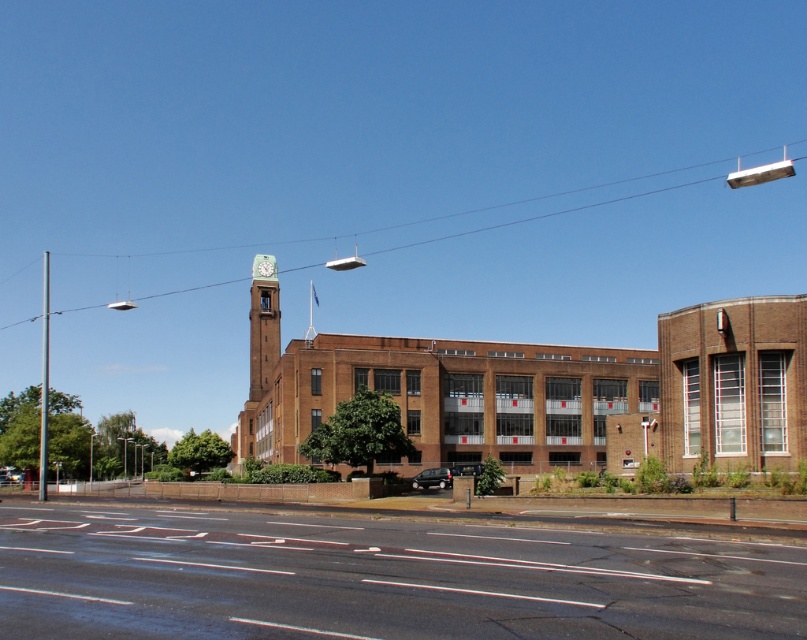
You are a delivery driver approaching the building and need to park your shiny black car at center. The parking space available is only as wide as the black asphalt road at lower center. Will your car fit into the space?

The black asphalt road at lower center is wider than the shiny black car at center, so the car will fit into the parking space.